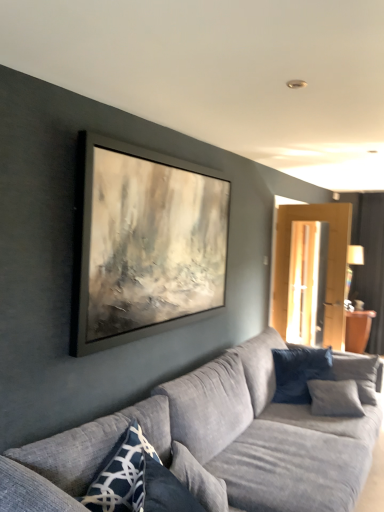
Question: Is dark blue fabric pillow at right, the second pillow positioned from the right, far from textured gray couch at center?

Choices:
 (A) no
 (B) yes

Answer: (A)

Question: Considering the relative sizes of dark blue fabric pillow at right, positioned as the 1th pillow in back-to-front order, and textured gray couch at center in the image provided, is dark blue fabric pillow at right, positioned as the 1th pillow in back-to-front order, bigger than textured gray couch at center?

Choices:
 (A) yes
 (B) no

Answer: (B)

Question: Does dark blue fabric pillow at right, positioned as the third pillow in front-to-back order, have a lesser height compared to textured gray couch at center?

Choices:
 (A) yes
 (B) no

Answer: (A)

Question: Is the position of dark blue fabric pillow at right, positioned as the third pillow in front-to-back order, less distant than that of textured gray couch at center?

Choices:
 (A) yes
 (B) no

Answer: (B)

Question: From the image's perspective, is dark blue fabric pillow at right, acting as the second pillow starting from the left, located beneath textured gray couch at center?

Choices:
 (A) yes
 (B) no

Answer: (B)

Question: From a real-world perspective, is dark blue fabric pillow at right, acting as the second pillow starting from the left, positioned above or below textured gray couch at center?

Choices:
 (A) above
 (B) below

Answer: (A)

Question: In terms of width, does dark blue fabric pillow at right, the second pillow positioned from the right, look wider or thinner when compared to textured gray couch at center?

Choices:
 (A) wide
 (B) thin

Answer: (B)

Question: Is dark blue fabric pillow at right, the second pillow positioned from the right, to the left or to the right of textured gray couch at center in the image?

Choices:
 (A) left
 (B) right

Answer: (B)

Question: In terms of height, does dark blue fabric pillow at right, positioned as the 1th pillow in back-to-front order, look taller or shorter compared to textured gray couch at center?

Choices:
 (A) tall
 (B) short

Answer: (B)

Question: Visually, is dark blue textured pillow at right, the first pillow when ordered from right to left, positioned to the left or to the right of blue textured pillow at lower left, the third pillow from the right?

Choices:
 (A) right
 (B) left

Answer: (A)

Question: Is dark blue textured pillow at right, which is the 2th pillow in front-to-back order, in front of or behind blue textured pillow at lower left, which ranks as the third pillow in back-to-front order, in the image?

Choices:
 (A) behind
 (B) front

Answer: (A)

Question: From their relative heights in the image, would you say dark blue textured pillow at right, which is the 2th pillow in front-to-back order, is taller or shorter than blue textured pillow at lower left, the 1th pillow when ordered from left to right?

Choices:
 (A) tall
 (B) short

Answer: (A)

Question: From a real-world perspective, is dark blue textured pillow at right, which ranks as the third pillow in left-to-right order, above or below blue textured pillow at lower left, which appears as the first pillow when viewed from the front?

Choices:
 (A) below
 (B) above

Answer: (A)

Question: Based on their positions, is dark blue textured pillow at right, which is the 2th pillow in front-to-back order, located to the left or right of textured gray couch at center?

Choices:
 (A) right
 (B) left

Answer: (A)

Question: From a real-world perspective, is dark blue textured pillow at right, the first pillow when ordered from right to left, positioned above or below textured gray couch at center?

Choices:
 (A) above
 (B) below

Answer: (A)